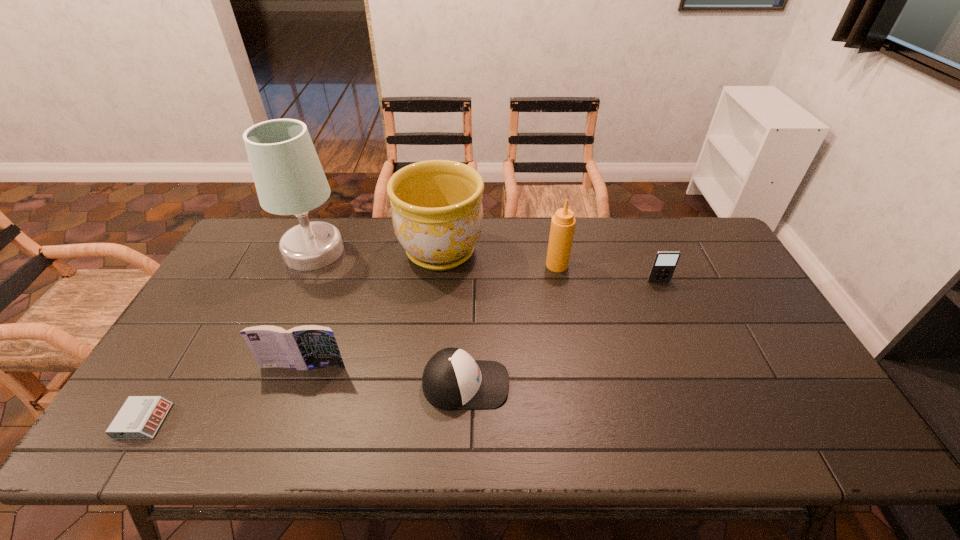
In order to click on lampshade in this screenshot , I will do `click(289, 179)`.

The width and height of the screenshot is (960, 540). In order to click on flowerpot in this screenshot , I will do `click(437, 214)`.

Locate an element on the screen. The image size is (960, 540). condiment is located at coordinates (563, 222).

I want to click on book, so click(304, 347).

Locate an element on the screen. The image size is (960, 540). iPod is located at coordinates (664, 264).

Identify the location of cap. The width and height of the screenshot is (960, 540). (452, 379).

Where is `the shortest object`? the shortest object is located at coordinates (140, 417).

The width and height of the screenshot is (960, 540). Find the location of `the leftmost object`. the leftmost object is located at coordinates (140, 417).

Where is `vacant space located on the base of the lampshade`? This screenshot has height=540, width=960. vacant space located on the base of the lampshade is located at coordinates (293, 299).

Identify the location of vacant area situated 0.050m on the left of the flowerpot. Image resolution: width=960 pixels, height=540 pixels. (383, 251).